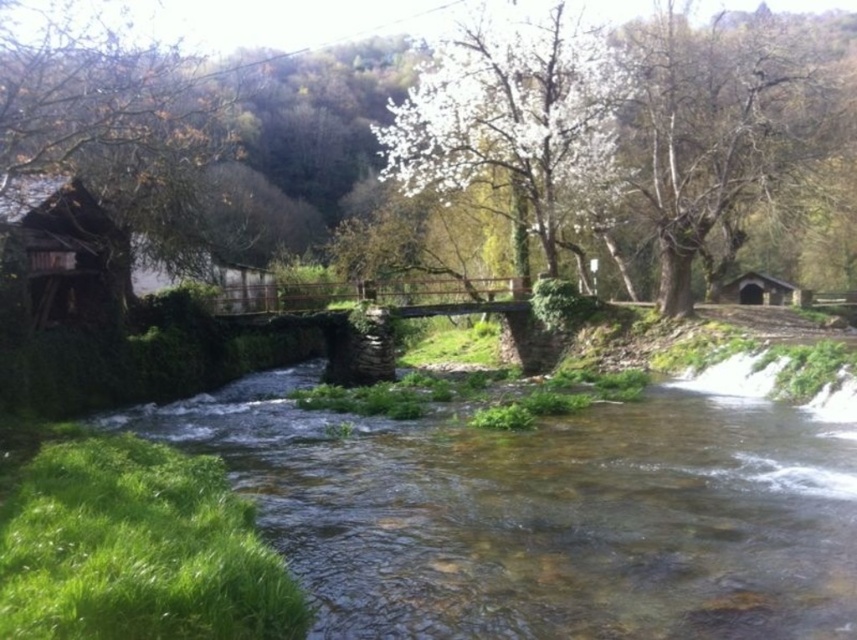
Question: Which object appears closest to the camera in this image?

Choices:
 (A) brown rough tree at upper right
 (B) clear water at center
 (C) green leafy tree at center

Answer: (B)

Question: Is clear water at center below brown rough tree at upper right?

Choices:
 (A) yes
 (B) no

Answer: (A)

Question: Can you confirm if brown rough tree at upper right is positioned to the left of brown rough tree at left?

Choices:
 (A) no
 (B) yes

Answer: (A)

Question: Which of the following is the closest to the observer?

Choices:
 (A) (596, 132)
 (B) (417, 16)
 (C) (716, 97)
 (D) (553, 512)

Answer: (D)

Question: Is clear water at center above green leafy tree at center?

Choices:
 (A) no
 (B) yes

Answer: (A)

Question: Which object is positioned farthest from the green leafy tree at center?

Choices:
 (A) brown rough tree at upper right
 (B) brown wood tree at center
 (C) clear water at center
 (D) brown rough tree at left

Answer: (C)